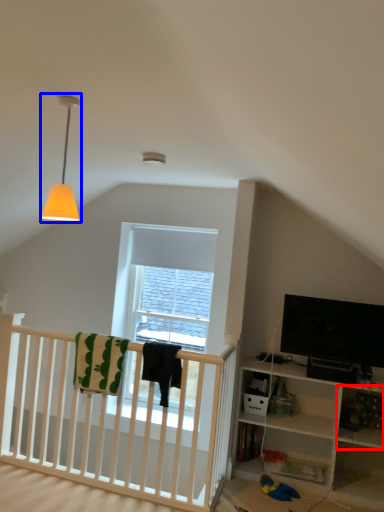
Question: Which object appears farthest to the camera in this image, shelf (highlighted by a red box) or lamp (highlighted by a blue box)?

Choices:
 (A) shelf
 (B) lamp

Answer: (A)